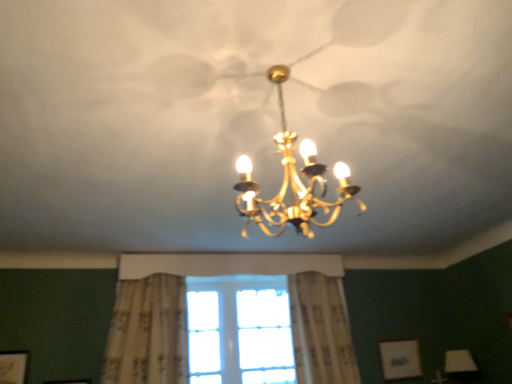
Question: Does matte white picture frame at lower left, positioned as the 2th picture frame in right-to-left order, appear on the right side of gold metallic chandelier at center?

Choices:
 (A) no
 (B) yes

Answer: (A)

Question: Can you confirm if matte white picture frame at lower left, placed as the first picture frame when sorted from left to right, is positioned to the left of gold metallic chandelier at center?

Choices:
 (A) yes
 (B) no

Answer: (A)

Question: Is matte white picture frame at lower left, the first picture frame from the front, taller than gold metallic chandelier at center?

Choices:
 (A) no
 (B) yes

Answer: (A)

Question: Is matte white picture frame at lower left, the first picture frame from the front, behind gold metallic chandelier at center?

Choices:
 (A) no
 (B) yes

Answer: (B)

Question: Does matte white picture frame at lower left, placed as the first picture frame when sorted from left to right, turn towards gold metallic chandelier at center?

Choices:
 (A) yes
 (B) no

Answer: (B)

Question: From a real-world perspective, is floral-patterned fabric curtain at center, which ranks as the first curtain in left-to-right order, above or below clear glass window at center?

Choices:
 (A) above
 (B) below

Answer: (A)

Question: Choose the correct answer: Is floral-patterned fabric curtain at center, which ranks as the first curtain in left-to-right order, inside clear glass window at center or outside it?

Choices:
 (A) inside
 (B) outside

Answer: (B)

Question: Is point (146, 327) positioned closer to the camera than point (211, 329)?

Choices:
 (A) farther
 (B) closer

Answer: (B)

Question: Is floral-patterned fabric curtain at center, which is the second curtain from right to left, taller or shorter than clear glass window at center?

Choices:
 (A) tall
 (B) short

Answer: (A)

Question: Considering the positions of matte white picture frame at lower right, placed as the 2th picture frame when sorted from left to right, and white textured curtain at center, the 1th curtain viewed from the right, in the image, is matte white picture frame at lower right, placed as the 2th picture frame when sorted from left to right, taller or shorter than white textured curtain at center, the 1th curtain viewed from the right,?

Choices:
 (A) tall
 (B) short

Answer: (B)

Question: Visually, is matte white picture frame at lower right, the 1th picture frame viewed from the back, positioned to the left or to the right of white textured curtain at center, the 1th curtain viewed from the right?

Choices:
 (A) right
 (B) left

Answer: (A)

Question: From the image's perspective, relative to white textured curtain at center, the 1th curtain viewed from the right, is matte white picture frame at lower right, which appears as the 2th picture frame when viewed from the front, above or below?

Choices:
 (A) below
 (B) above

Answer: (A)

Question: Would you say matte white picture frame at lower right, which is counted as the 1th picture frame, starting from the right, is inside or outside white textured curtain at center, the 1th curtain viewed from the right?

Choices:
 (A) outside
 (B) inside

Answer: (A)

Question: Is matte white picture frame at lower left, the second picture frame positioned from the back, in front of or behind floral-patterned fabric curtain at center, which ranks as the first curtain in left-to-right order, in the image?

Choices:
 (A) behind
 (B) front

Answer: (A)

Question: From the image's perspective, is matte white picture frame at lower left, the first picture frame from the front, located above or below floral-patterned fabric curtain at center, which is the second curtain from right to left?

Choices:
 (A) above
 (B) below

Answer: (B)